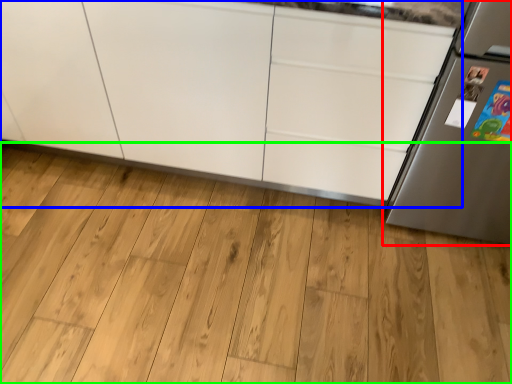
Question: Which object is positioned closest to refrigerator (highlighted by a red box)? Select from cabinetry (highlighted by a blue box) and hardwood (highlighted by a green box).

Choices:
 (A) cabinetry
 (B) hardwood

Answer: (A)